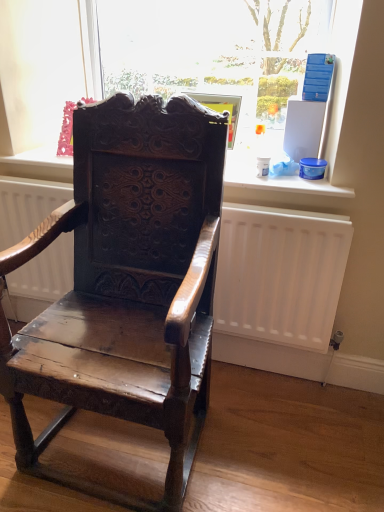
Identify the location of vacant space underneath shiny dark wood chair at center (from a real-world perspective). (116, 447).